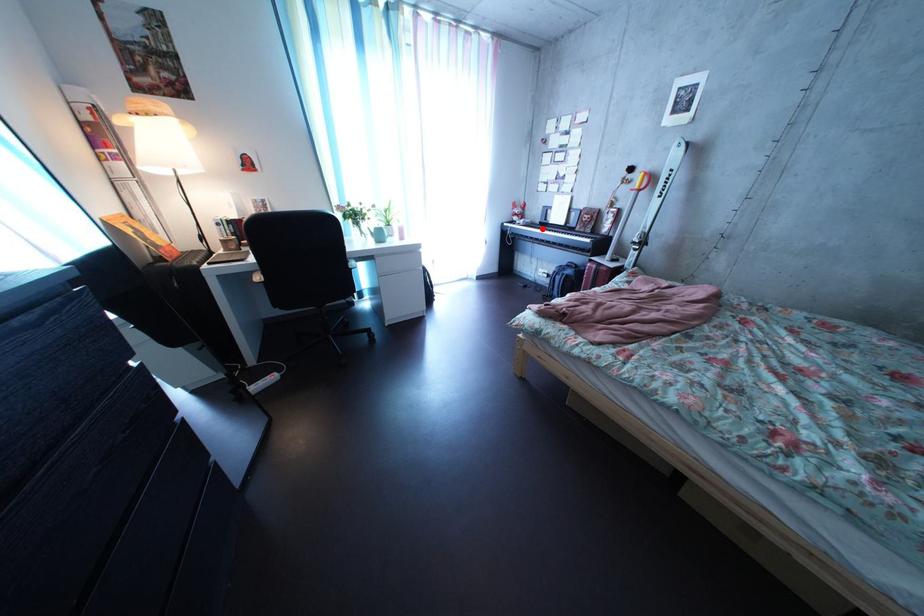
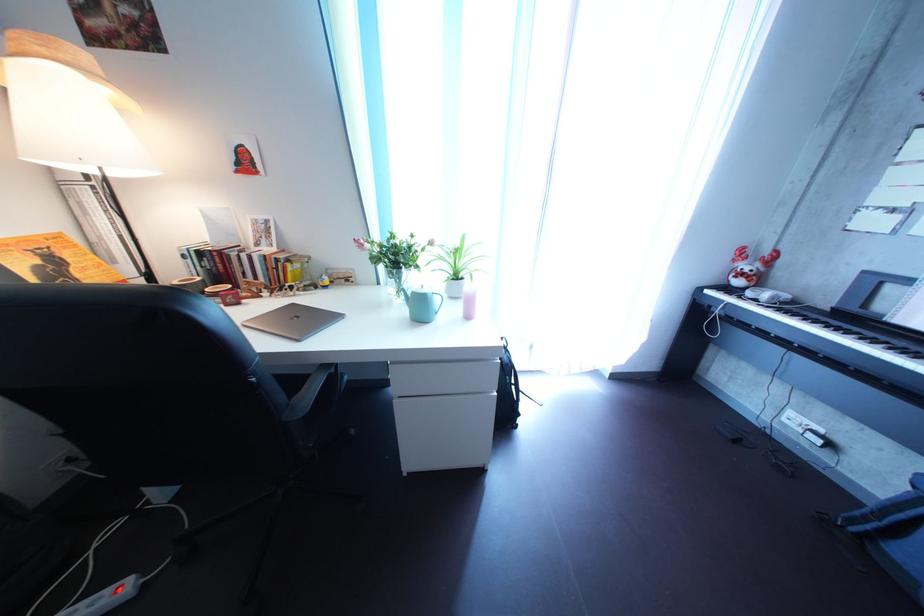
Find the pixel in the second image that matches the highlighted location in the first image.

(801, 304)